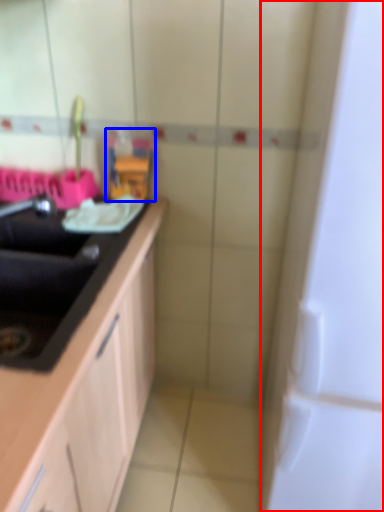
Question: Among these objects, which one is farthest to the camera, appliance (highlighted by a red box) or toy (highlighted by a blue box)?

Choices:
 (A) appliance
 (B) toy

Answer: (B)